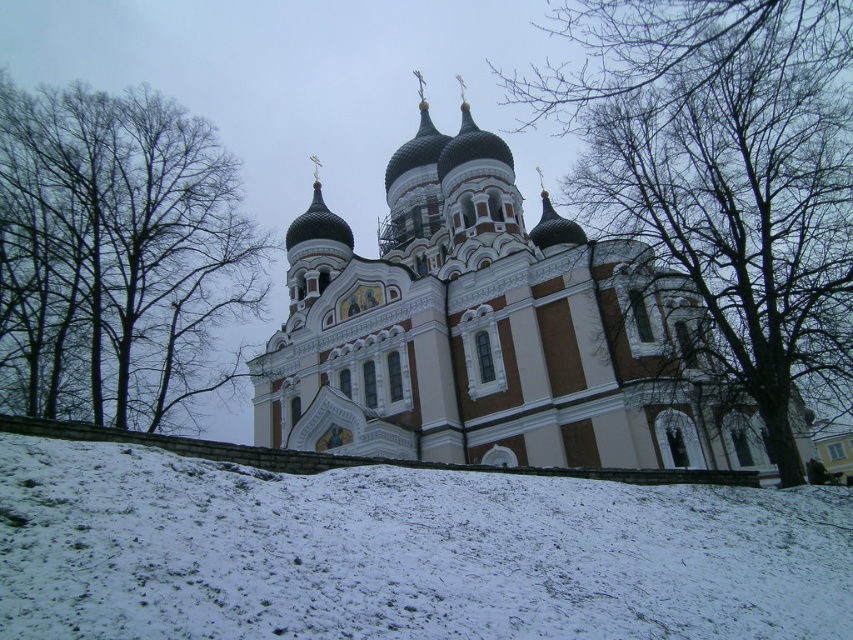
Question: Which object appears closest to the camera in this image?

Choices:
 (A) brown bark tree at upper left
 (B) white stone church at center

Answer: (B)

Question: Does white powdery snow at lower center come behind brown bark tree at upper left?

Choices:
 (A) no
 (B) yes

Answer: (A)

Question: Which point is closer to the camera taking this photo?

Choices:
 (A) (172, 374)
 (B) (469, 358)
 (C) (518, 608)

Answer: (C)

Question: Among these objects, which one is nearest to the camera?

Choices:
 (A) white powdery snow at lower center
 (B) bare branches at upper right

Answer: (A)

Question: Can you confirm if white stone church at center is positioned to the right of bare branches at upper right?

Choices:
 (A) no
 (B) yes

Answer: (A)

Question: From the image, what is the correct spatial relationship of white stone church at center in relation to bare branches at upper right?

Choices:
 (A) below
 (B) above

Answer: (A)